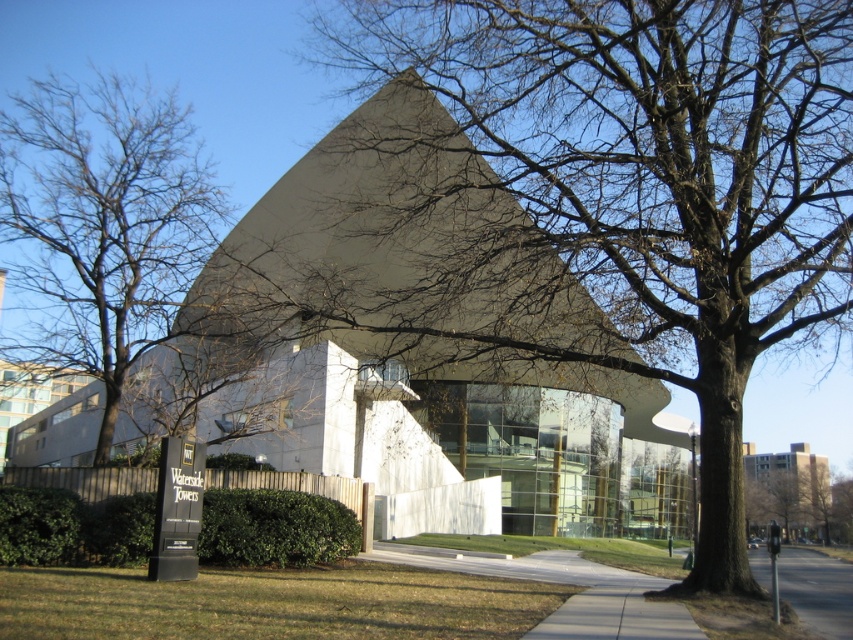
Question: Does brown textured tree at center have a larger size compared to gray asphalt at lower right?

Choices:
 (A) yes
 (B) no

Answer: (B)

Question: Which of the following is the closest to the observer?

Choices:
 (A) (849, 611)
 (B) (801, 490)
 (C) (120, 228)

Answer: (A)

Question: Does bare branches at center appear under brown textured tree at center?

Choices:
 (A) no
 (B) yes

Answer: (A)

Question: Which point appears farthest from the camera in this image?

Choices:
 (A) click(x=811, y=496)
 (B) click(x=781, y=560)

Answer: (A)

Question: Which of these objects is positioned farthest from the bare branches at center?

Choices:
 (A) brown textured tree at center
 (B) gray asphalt at lower right

Answer: (A)

Question: Does brown textured tree at center appear on the right side of gray asphalt at lower right?

Choices:
 (A) yes
 (B) no

Answer: (A)